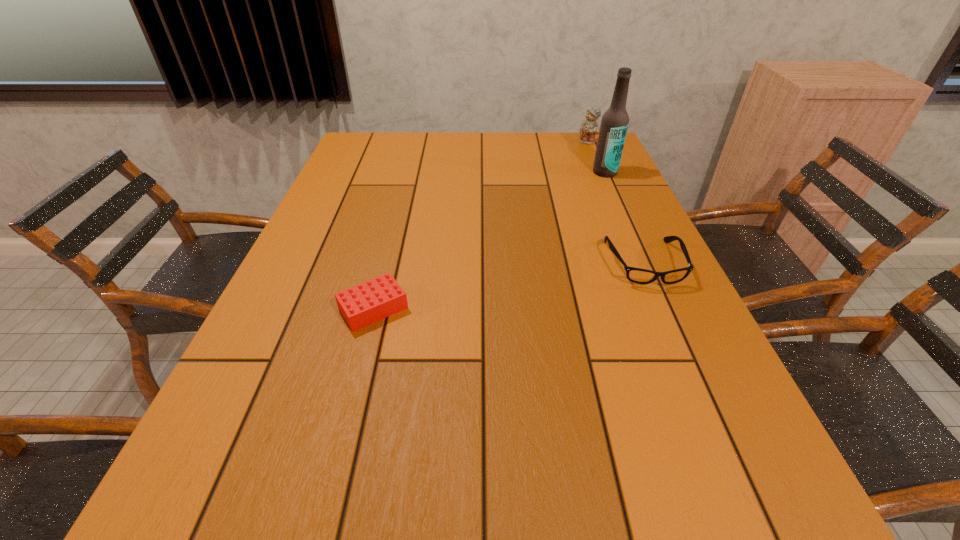
Where is `Lego`? Lego is located at coordinates (366, 303).

You are a GUI agent. You are given a task and a screenshot of the screen. Output one action in this format:
    pyautogui.click(x=<x>, y=<y>)
    Task: Click on the spectacles
    The height and width of the screenshot is (540, 960).
    Given the screenshot: What is the action you would take?
    pyautogui.click(x=636, y=275)

Locate an element on the screen. This screenshot has width=960, height=540. beer bottle is located at coordinates (614, 124).

Find the location of a particular element. This screenshot has width=960, height=540. the tallest object is located at coordinates (614, 124).

Identify the location of the third shortest object. (x=589, y=128).

Image resolution: width=960 pixels, height=540 pixels. I want to click on the farthest object, so click(x=589, y=128).

Where is `free space located 0.330m on the back of the leftmost object`? This screenshot has height=540, width=960. free space located 0.330m on the back of the leftmost object is located at coordinates (399, 208).

Locate an element on the screen. vacant space located on the front-facing side of the spectacles is located at coordinates (681, 344).

Find the location of a particular element. The width and height of the screenshot is (960, 540). blank space located on the side of the beer bottle with the label is located at coordinates (568, 244).

Where is `vacant space situated 0.370m on the side of the beer bottle with the label`? vacant space situated 0.370m on the side of the beer bottle with the label is located at coordinates (569, 241).